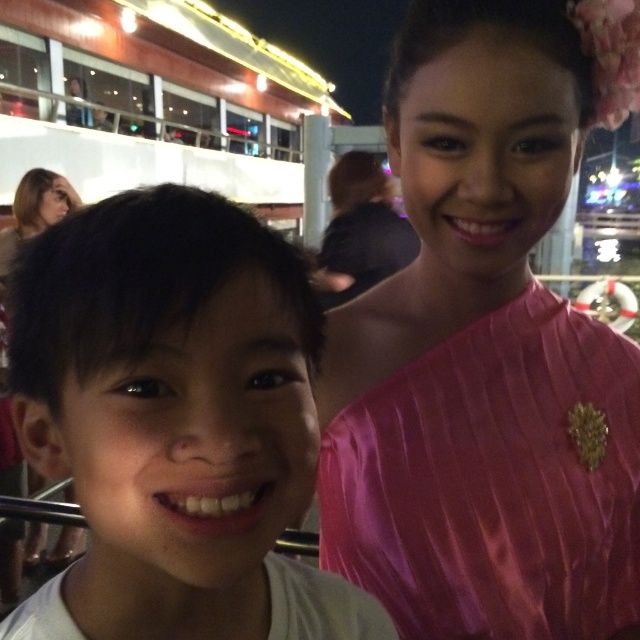
Question: Which point is farther to the camera?

Choices:
 (A) pink satin brooch at upper right
 (B) white matte shirt at center

Answer: (A)

Question: Is white matte shirt at center wider than pink satin brooch at upper right?

Choices:
 (A) no
 (B) yes

Answer: (A)

Question: Does white matte shirt at center have a greater width compared to pink satin brooch at upper right?

Choices:
 (A) yes
 (B) no

Answer: (B)

Question: Which object appears farthest from the camera in this image?

Choices:
 (A) pink satin brooch at upper right
 (B) white matte shirt at center

Answer: (A)

Question: Can you confirm if white matte shirt at center is thinner than pink satin brooch at upper right?

Choices:
 (A) yes
 (B) no

Answer: (A)